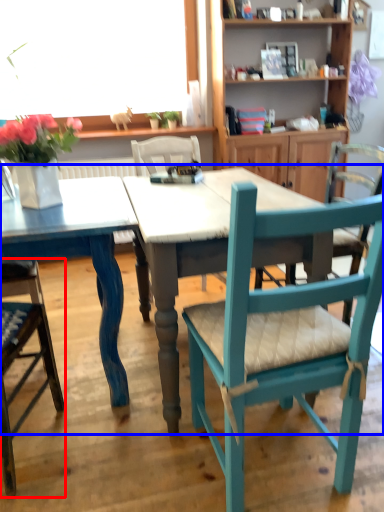
Question: Which point is closer to the camera, chair (highlighted by a red box) or kitchen & dining room table (highlighted by a blue box)?

Choices:
 (A) chair
 (B) kitchen & dining room table

Answer: (A)